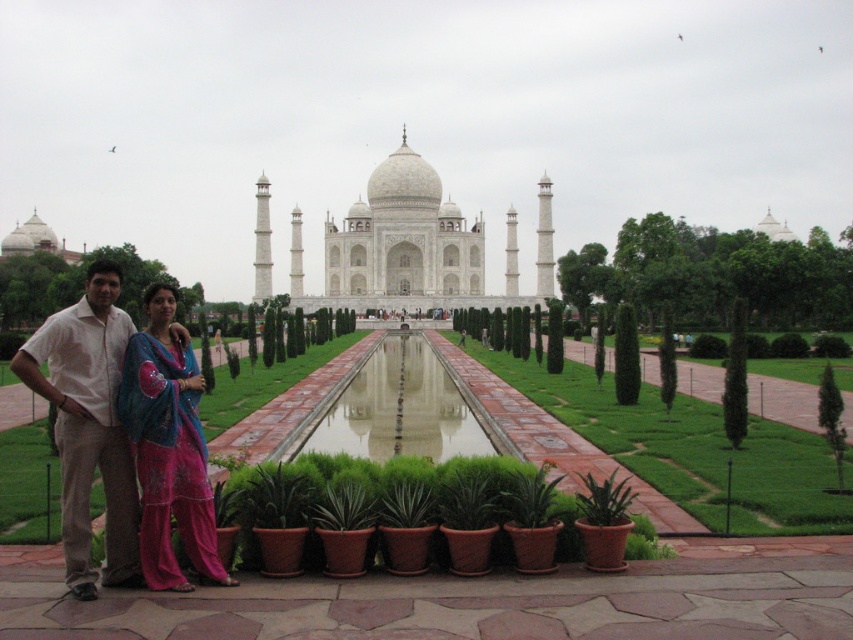
Is green leafy plant at center to the left of light beige cotton shirt at center from the viewer's perspective?

No, green leafy plant at center is not to the left of light beige cotton shirt at center.

Between point (741, 493) and point (79, 465), which one is positioned behind?

The point (741, 493) is behind.

This screenshot has width=853, height=640. I want to click on green leafy plant at center, so click(692, 451).

Can you confirm if green leafy plant at center is thinner than shiny blue fabric at center?

No, green leafy plant at center is not thinner than shiny blue fabric at center.

Looking at this image, does green leafy plant at center appear over shiny blue fabric at center?

Actually, green leafy plant at center is below shiny blue fabric at center.

Which is behind, point (643, 400) or point (144, 579)?

The point (643, 400) is behind.

Locate an element on the screen. The width and height of the screenshot is (853, 640). green leafy plant at center is located at coordinates (692, 451).

Is light beige cotton shirt at center in front of shiny blue fabric at center?

Yes, light beige cotton shirt at center is in front of shiny blue fabric at center.

Is light beige cotton shirt at center shorter than shiny blue fabric at center?

No, light beige cotton shirt at center is not shorter than shiny blue fabric at center.

What are the coordinates of `light beige cotton shirt at center` in the screenshot? It's located at pyautogui.click(x=88, y=426).

This screenshot has width=853, height=640. I want to click on light beige cotton shirt at center, so click(x=88, y=426).